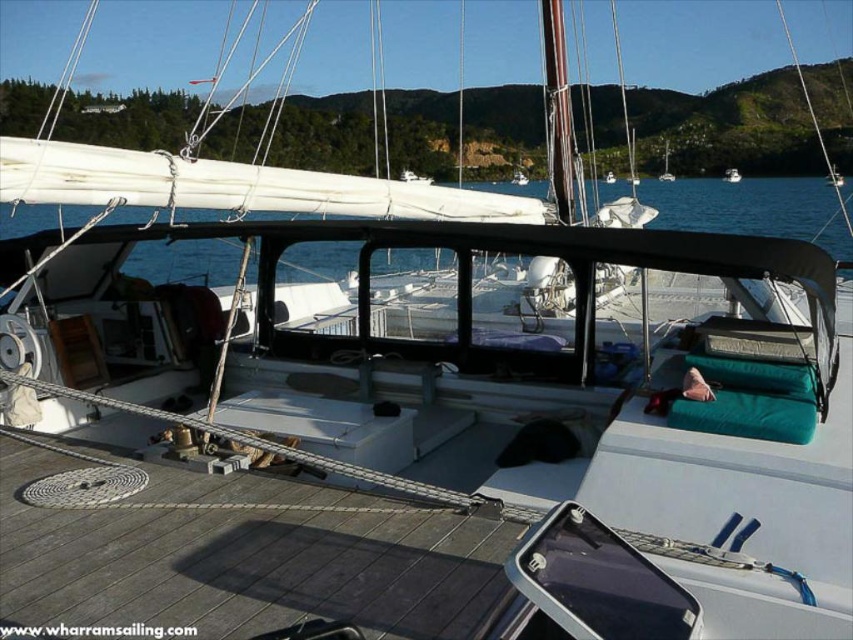
Is the position of transparent water at center more distant than that of white matte boat at center?

No.

Can you confirm if transparent water at center is positioned to the left of white matte boat at center?

Indeed, transparent water at center is positioned on the left side of white matte boat at center.

This screenshot has width=853, height=640. I want to click on transparent water at center, so click(751, 209).

Where is `transparent water at center`? This screenshot has height=640, width=853. transparent water at center is located at coordinates (751, 209).